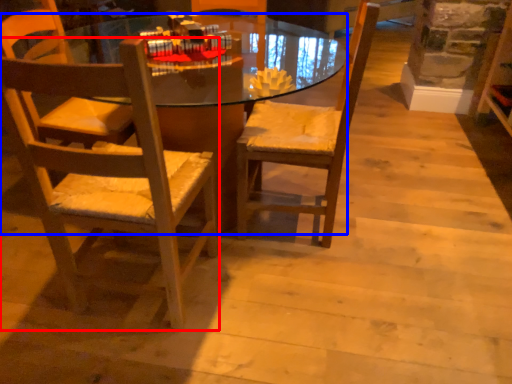
Question: Which point is further to the camera, chair (highlighted by a red box) or desk (highlighted by a blue box)?

Choices:
 (A) chair
 (B) desk

Answer: (B)